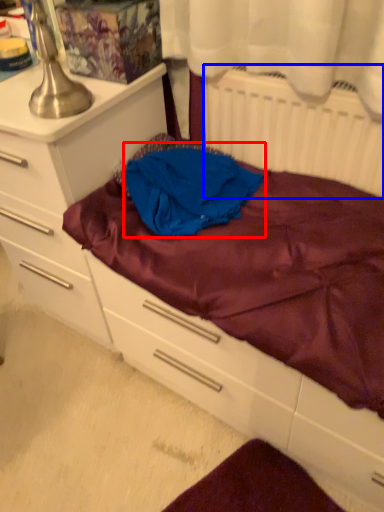
Question: Which of the following is the farthest to the observer, clothing (highlighted by a red box) or radiator (highlighted by a blue box)?

Choices:
 (A) clothing
 (B) radiator

Answer: (A)